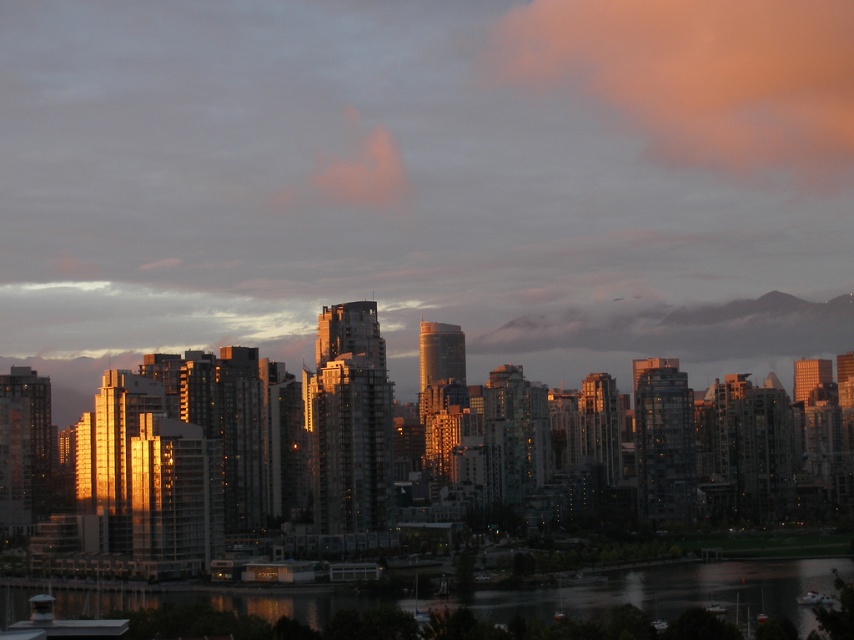
Who is taller, pink fluffy cloud at upper center or reflective glass water at lower center?

pink fluffy cloud at upper center

Does pink fluffy cloud at upper center have a greater height compared to reflective glass water at lower center?

Correct, pink fluffy cloud at upper center is much taller as reflective glass water at lower center.

Where is `pink fluffy cloud at upper center`? The height and width of the screenshot is (640, 854). pink fluffy cloud at upper center is located at coordinates (703, 76).